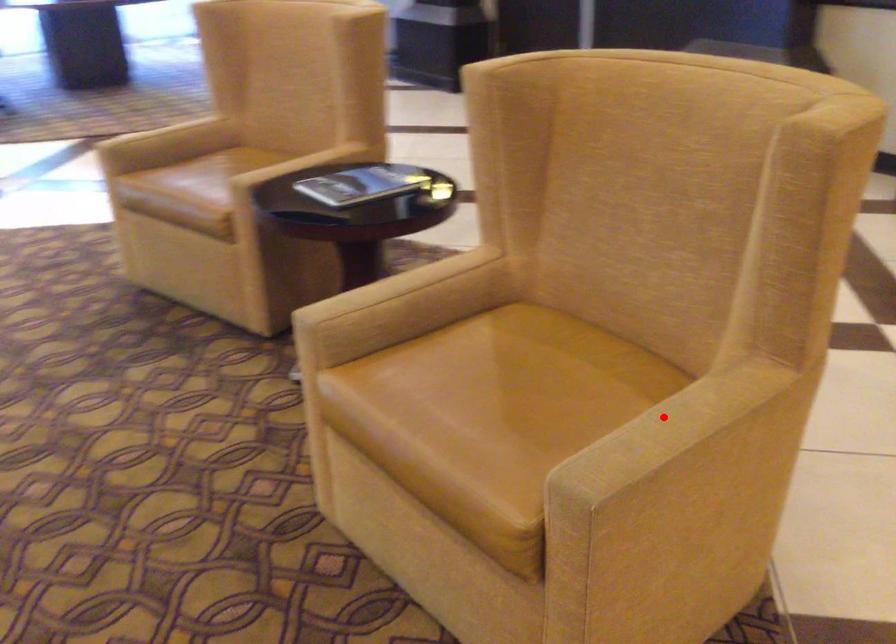
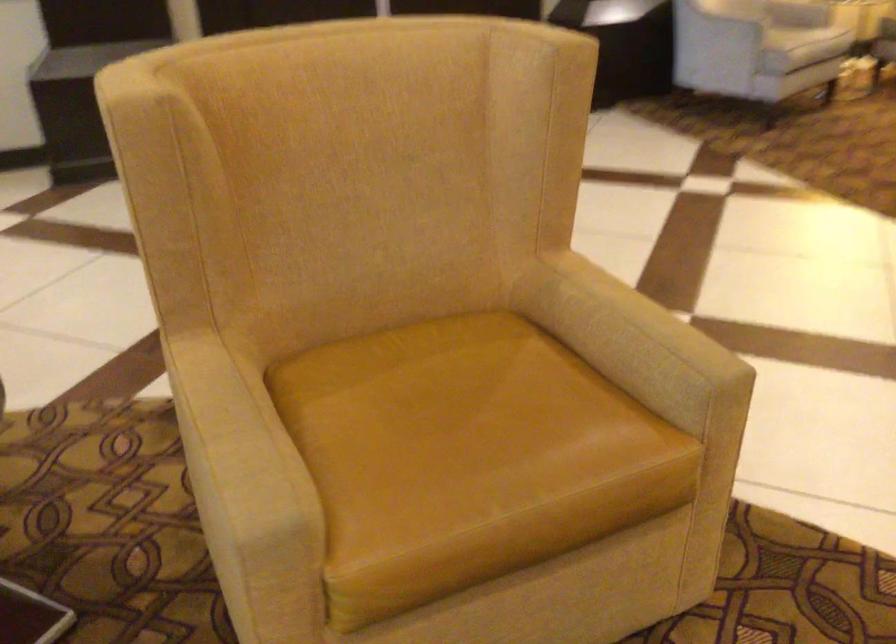
Question: A red point is marked in image1. In image2, is the corresponding 3D point closer to the camera or farther? Reply with the corresponding letter.

Choices:
 (A) The corresponding 3D point is closer.
 (B) The corresponding 3D point is farther.

Answer: (B)